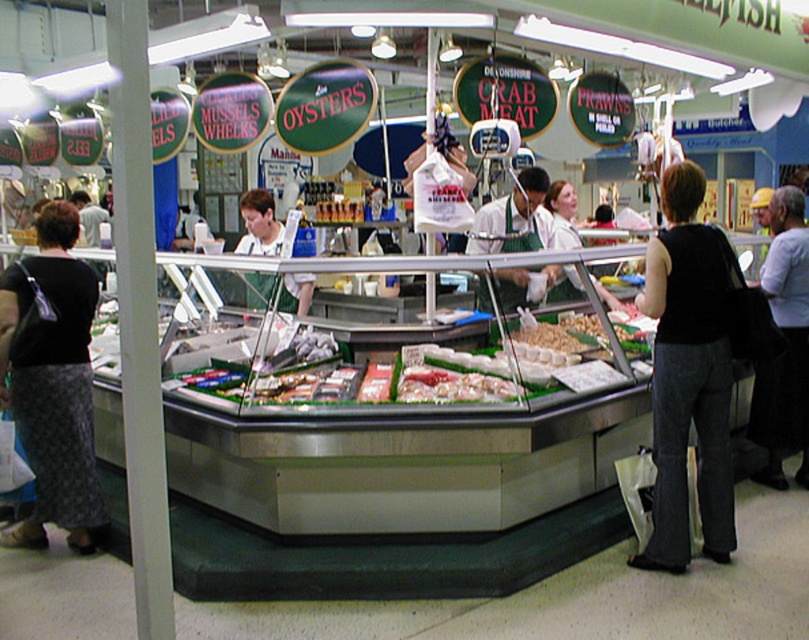
You are a customer at the seafood market stall. You notice a black fabric at right and a green apron at center. Which one is bigger in size?

The black fabric at right is larger in size compared to the green apron at center.

You are a customer at the seafood market stall. You want to reach the point labeled as point (710, 486) from your current position at point (274, 225). Can you walk directly towards it without any obstacles in your path?

Point (710, 486) is in front of point (274, 225), so yes, you can walk directly towards it without any obstacles in your path.

You are a customer at the seafood market stall. You see a black fabric at right and a green apron at center. Which one is taller?

The black fabric at right is much taller than the green apron at center.